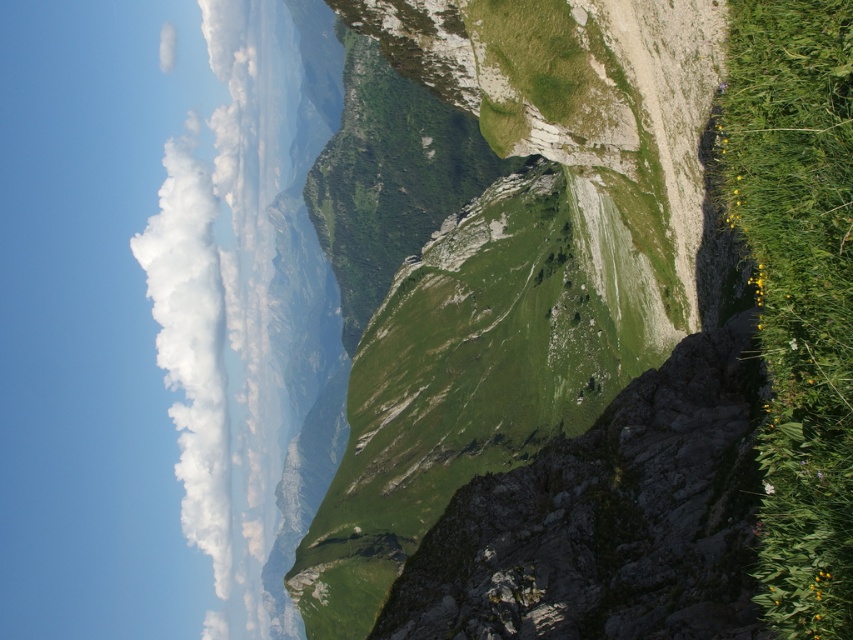
Question: Which point is farther to the camera?

Choices:
 (A) white fluffy cloud at upper left
 (B) green grassy hillside at center

Answer: (A)

Question: In this image, where is green grassy hillside at center located relative to white fluffy cloud at upper left?

Choices:
 (A) above
 (B) below

Answer: (B)

Question: Which object appears farthest from the camera in this image?

Choices:
 (A) white fluffy cloud at upper left
 (B) green grassy hillside at center

Answer: (A)

Question: Does green grassy hillside at center have a lesser width compared to white fluffy cloud at upper left?

Choices:
 (A) no
 (B) yes

Answer: (B)

Question: Can you confirm if green grassy hillside at center is positioned below white fluffy cloud at upper left?

Choices:
 (A) no
 (B) yes

Answer: (B)